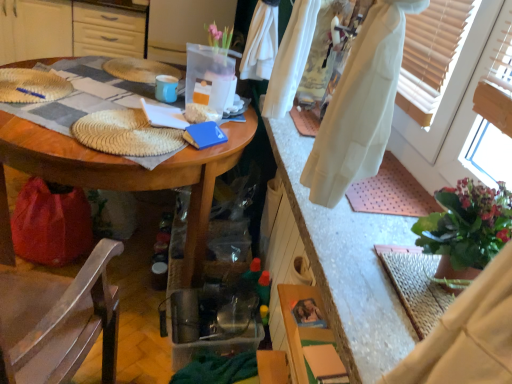
Question: Considering the relative positions of wooden chair at lower left and white cotton robe at lower right in the image provided, is wooden chair at lower left behind white cotton robe at lower right?

Choices:
 (A) no
 (B) yes

Answer: (A)

Question: Could white cotton robe at lower right be considered to be inside wooden chair at lower left?

Choices:
 (A) yes
 (B) no

Answer: (B)

Question: Is the depth of wooden chair at lower left less than that of white cotton robe at lower right?

Choices:
 (A) yes
 (B) no

Answer: (A)

Question: Would you say wooden chair at lower left is a long distance from white cotton robe at lower right?

Choices:
 (A) yes
 (B) no

Answer: (B)

Question: Is wooden chair at lower left positioned with its back to white cotton robe at lower right?

Choices:
 (A) no
 (B) yes

Answer: (A)

Question: From a real-world perspective, is wooden chair at lower left on white cotton robe at lower right?

Choices:
 (A) no
 (B) yes

Answer: (A)

Question: Can you confirm if green leafy plant at right is positioned to the right of white cotton robe at lower right?

Choices:
 (A) yes
 (B) no

Answer: (B)

Question: Considering the relative sizes of green leafy plant at right and white cotton robe at lower right in the image provided, is green leafy plant at right thinner than white cotton robe at lower right?

Choices:
 (A) no
 (B) yes

Answer: (B)

Question: From a real-world perspective, is green leafy plant at right beneath white cotton robe at lower right?

Choices:
 (A) yes
 (B) no

Answer: (B)

Question: Considering the relative sizes of green leafy plant at right and white cotton robe at lower right in the image provided, is green leafy plant at right bigger than white cotton robe at lower right?

Choices:
 (A) yes
 (B) no

Answer: (A)

Question: From the image's perspective, is green leafy plant at right located above white cotton robe at lower right?

Choices:
 (A) yes
 (B) no

Answer: (A)

Question: Is green leafy plant at right wider than white cotton robe at lower right?

Choices:
 (A) no
 (B) yes

Answer: (A)

Question: From the image's perspective, is wooden table at center over white cotton robe at lower right?

Choices:
 (A) no
 (B) yes

Answer: (B)